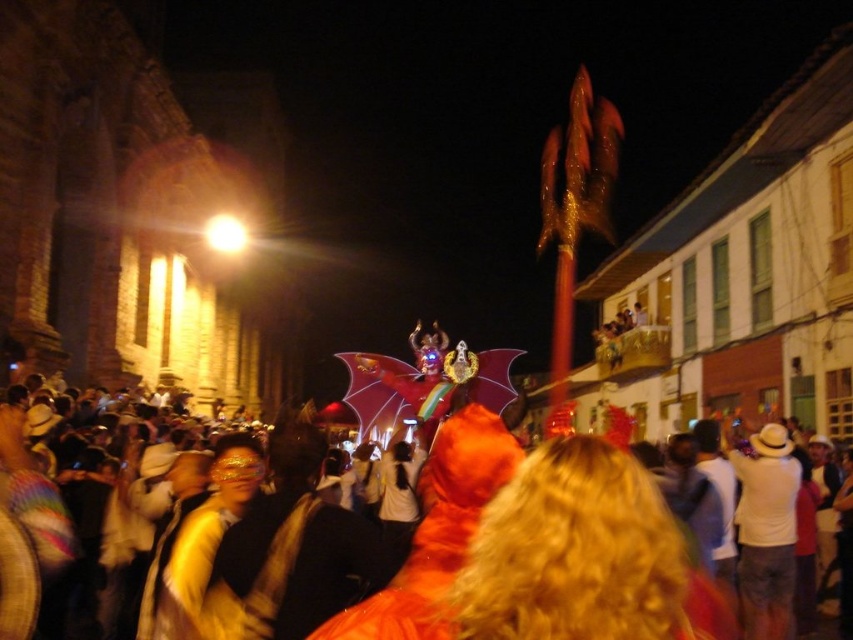
You are a photographer trying to capture both the orange fur coat at center and the orange furry costume at center in a single shot. Since you want to emphasize the larger object, which one should you focus on to ensure it stands out more in the photo?

The orange fur coat at center has a larger size compared to orange furry costume at center, so focusing on the orange fur coat at center will make it stand out more in the photo.